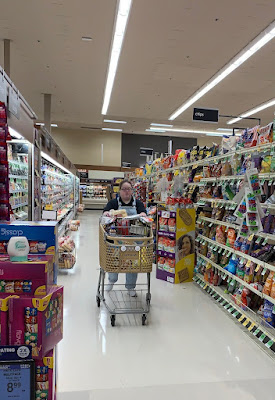
This screenshot has width=275, height=400. In order to click on refrigerator section in this screenshot , I will do `click(92, 189)`, `click(59, 177)`, `click(15, 182)`.